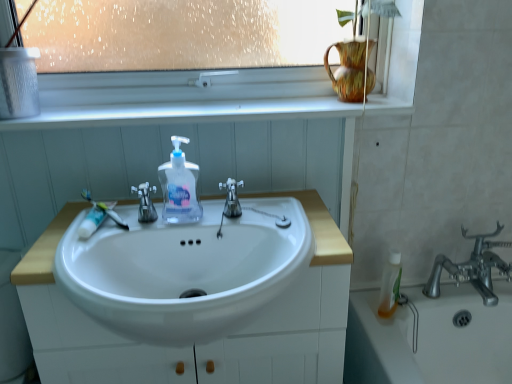
Where is `vacant space to the right of polished chrome faucet at center, the second tap positioned from the left`? vacant space to the right of polished chrome faucet at center, the second tap positioned from the left is located at coordinates (292, 228).